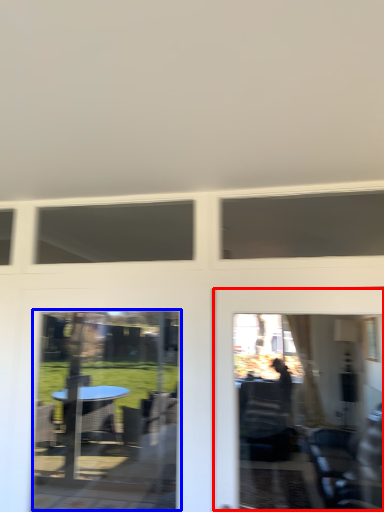
Question: Which object is further to the camera taking this photo, garage door (highlighted by a red box) or screen door (highlighted by a blue box)?

Choices:
 (A) garage door
 (B) screen door

Answer: (B)